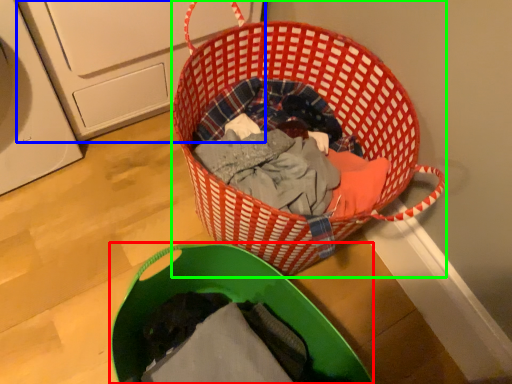
Question: Estimate the real-world distances between objects in this image. Which object is closer to laundry basket (highlighted by a red box), washing machine (highlighted by a blue box) or picnic basket (highlighted by a green box)?

Choices:
 (A) washing machine
 (B) picnic basket

Answer: (B)